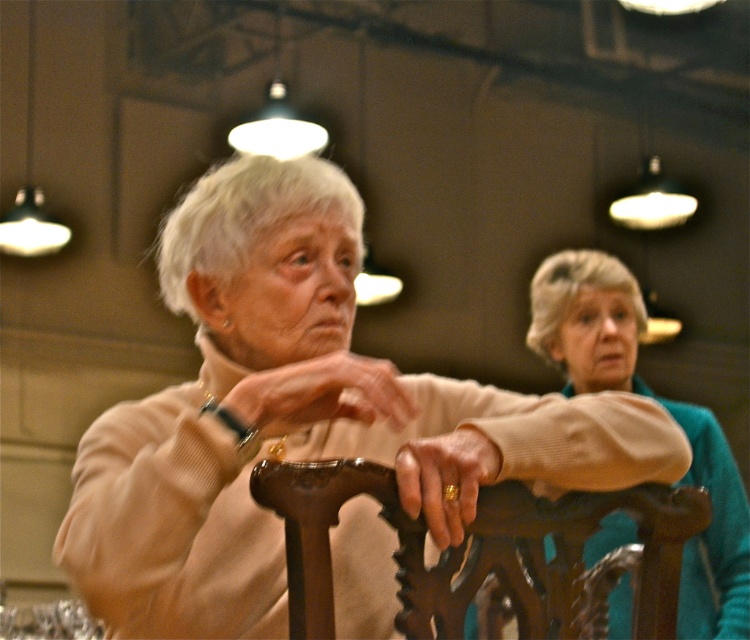
Can you confirm if matte beige sweater at center is positioned to the right of smooth beige hand at center?

In fact, matte beige sweater at center is to the left of smooth beige hand at center.

Can you confirm if matte beige sweater at center is shorter than smooth beige hand at center?

In fact, matte beige sweater at center may be taller than smooth beige hand at center.

Does point (616, 445) come farther from viewer compared to point (366, 413)?

No, (616, 445) is in front of (366, 413).

Locate an element on the screen. The image size is (750, 640). matte beige sweater at center is located at coordinates 290,412.

Is point (290, 397) farther from camera compared to point (447, 444)?

That is True.

Does smooth beige hand at center have a greater height compared to gold metallic ring at center?

In fact, smooth beige hand at center may be shorter than gold metallic ring at center.

Who is more distant from viewer, (290, 410) or (453, 472)?

Positioned behind is point (290, 410).

The image size is (750, 640). What are the coordinates of `smooth beige hand at center` in the screenshot? It's located at (321, 394).

The width and height of the screenshot is (750, 640). What do you see at coordinates (290, 412) in the screenshot?
I see `matte beige sweater at center` at bounding box center [290, 412].

Which is above, matte beige sweater at center or polished wood chair at center?

matte beige sweater at center is above.

Where is `matte beige sweater at center`? This screenshot has height=640, width=750. matte beige sweater at center is located at coordinates (290, 412).